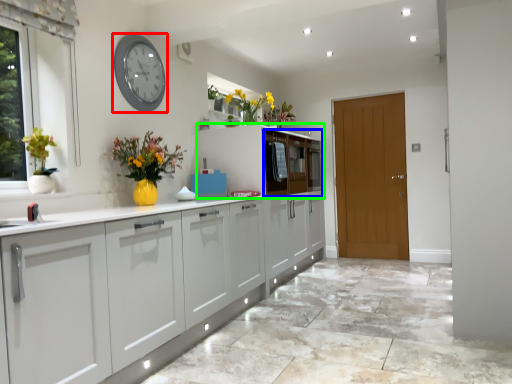
Question: Which object is positioned closest to clock (highlighted by a red box)? Select from drawer (highlighted by a blue box) and cabinetry (highlighted by a green box).

Choices:
 (A) drawer
 (B) cabinetry

Answer: (B)